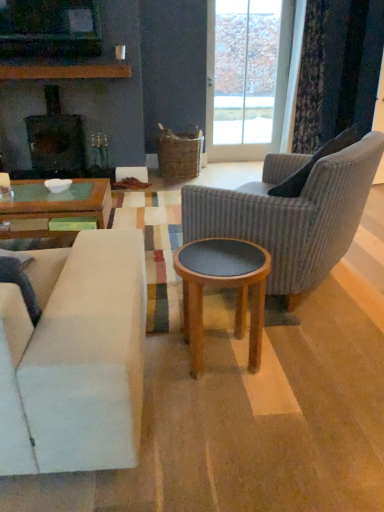
At what (x,y) coordinates should I click in order to perform the action: click on vacant area to the right of wooden round stool at center. Please return your answer as a coordinate pair (x, y). Image resolution: width=384 pixels, height=512 pixels. Looking at the image, I should click on (301, 358).